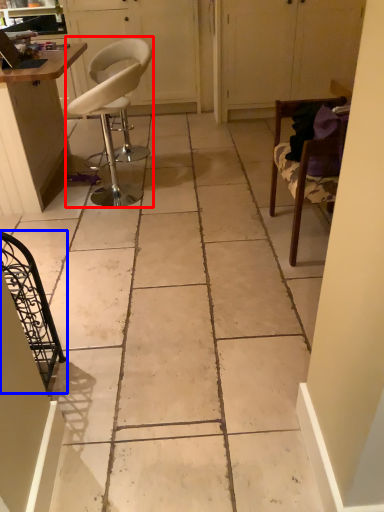
Question: Which object is further to the camera taking this photo, chair (highlighted by a red box) or chair (highlighted by a blue box)?

Choices:
 (A) chair
 (B) chair

Answer: (A)